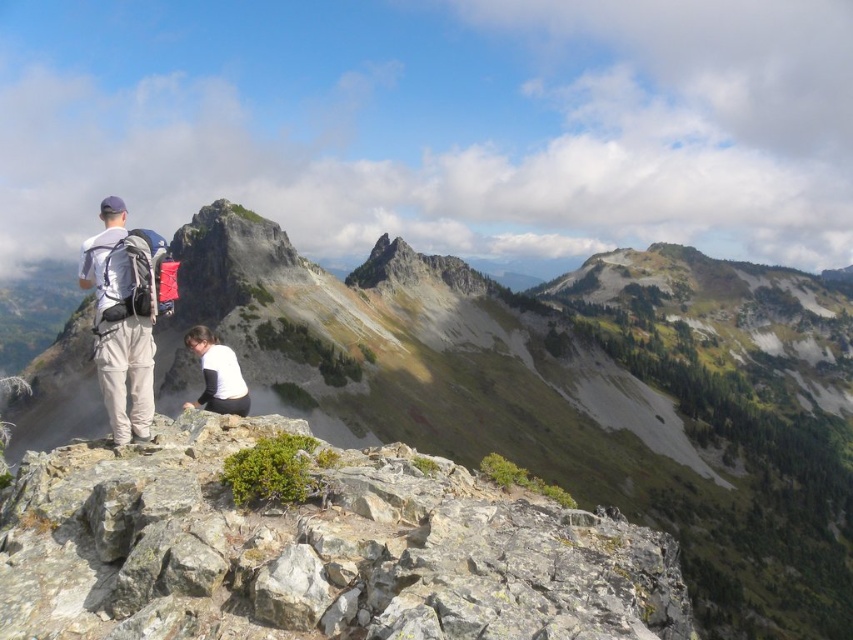
Is point (498, 316) positioned in front of point (126, 339)?

No, it is not.

Looking at this image, can you confirm if rugged stone mountain at upper center is taller than matte gray backpack at left?

Yes.

Where is `rugged stone mountain at upper center`? This screenshot has width=853, height=640. rugged stone mountain at upper center is located at coordinates pos(576,390).

Does gray rough rock at center appear on the left side of matte gray backpack at left?

Incorrect, gray rough rock at center is not on the left side of matte gray backpack at left.

Does gray rough rock at center have a greater width compared to matte gray backpack at left?

Yes, gray rough rock at center is wider than matte gray backpack at left.

Does point (395, 464) come closer to viewer compared to point (114, 420)?

Yes, it is in front of point (114, 420).

Identify the location of gray rough rock at center. (312, 548).

Based on the photo, does matte gray backpack at left have a lesser width compared to white matte shirt at center?

Indeed, matte gray backpack at left has a lesser width compared to white matte shirt at center.

Is matte gray backpack at left closer to camera compared to white matte shirt at center?

Yes, it is in front of white matte shirt at center.

Which is in front, point (135, 358) or point (230, 372)?

Point (135, 358)

Identify the location of matte gray backpack at left. The height and width of the screenshot is (640, 853). (119, 326).